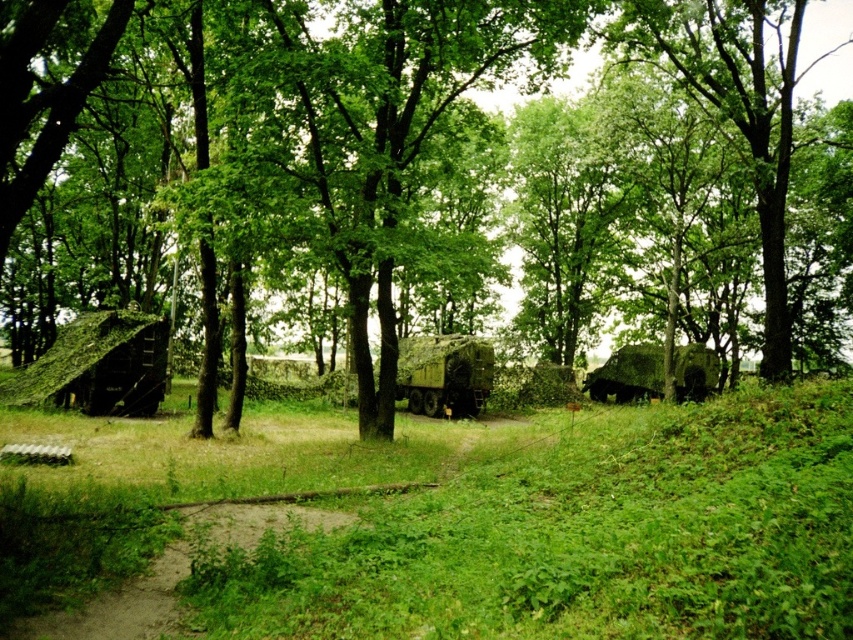
Who is more distant from viewer, (340, 604) or (653, 349)?

Point (653, 349)

The image size is (853, 640). What do you see at coordinates (514, 524) in the screenshot?
I see `green grassy at lower center` at bounding box center [514, 524].

What do you see at coordinates (514, 524) in the screenshot? The height and width of the screenshot is (640, 853). I see `green grassy at lower center` at bounding box center [514, 524].

Where is `green grassy at lower center`? green grassy at lower center is located at coordinates (514, 524).

Can you confirm if green grassy at lower center is positioned to the left of green moss-covered log cabin at left?

No, green grassy at lower center is not to the left of green moss-covered log cabin at left.

Which is above, green grassy at lower center or green moss-covered log cabin at left?

green moss-covered log cabin at left

Is point (540, 614) closer to viewer compared to point (67, 404)?

Yes, it is in front of point (67, 404).

Identify the location of green grassy at lower center. The image size is (853, 640). (514, 524).

Does green grassy at lower center have a greater height compared to green leafy tree at center?

No, green grassy at lower center is not taller than green leafy tree at center.

The height and width of the screenshot is (640, 853). Identify the location of green grassy at lower center. (514, 524).